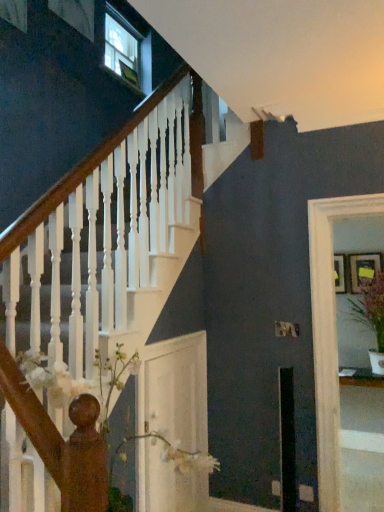
Locate an element on the screen. white glossy door at center, the 2th glass door in the right-to-left sequence is located at coordinates (175, 390).

The height and width of the screenshot is (512, 384). In order to click on wooden picture frame at right, the second picture frame in the right-to-left sequence in this screenshot , I will do `click(339, 273)`.

I want to click on white glossy door at center, the first glass door when ordered from left to right, so pos(175,390).

Which is in front, point (342, 289) or point (325, 293)?

The point (325, 293) is more forward.

Based on the photo, between wooden picture frame at right, the second picture frame in the right-to-left sequence, and clear glass door at right, the 2th glass door viewed from the left, which one has smaller size?

wooden picture frame at right, the second picture frame in the right-to-left sequence, is smaller.

Considering the relative sizes of wooden picture frame at right, the second picture frame in the right-to-left sequence, and clear glass door at right, the 2th glass door viewed from the left, in the image provided, is wooden picture frame at right, the second picture frame in the right-to-left sequence, taller than clear glass door at right, the 2th glass door viewed from the left,?

In fact, wooden picture frame at right, the second picture frame in the right-to-left sequence, may be shorter than clear glass door at right, the 2th glass door viewed from the left.

Is wooden picture frame at upper right, the 1th picture frame from the right, not within green leafy plant in white pot at right?

Yes.

Considering the relative sizes of wooden picture frame at upper right, the 1th picture frame from the right, and green leafy plant in white pot at right in the image provided, is wooden picture frame at upper right, the 1th picture frame from the right, smaller than green leafy plant in white pot at right?

Yes.

Which object is positioned more to the right, wooden picture frame at upper right, the 2th picture frame from the left, or green leafy plant in white pot at right?

From the viewer's perspective, wooden picture frame at upper right, the 2th picture frame from the left, appears more on the right side.

Is wooden picture frame at right, the second picture frame in the right-to-left sequence, positioned far away from green leafy plant in white pot at right?

wooden picture frame at right, the second picture frame in the right-to-left sequence, is actually quite close to green leafy plant in white pot at right.

The height and width of the screenshot is (512, 384). Find the location of `plant on the right of the wooden picture frame at right, the second picture frame in the right-to-left sequence`. plant on the right of the wooden picture frame at right, the second picture frame in the right-to-left sequence is located at coordinates (370, 306).

Considering the sizes of objects wooden picture frame at right, the second picture frame in the right-to-left sequence, and green leafy plant in white pot at right in the image provided, who is smaller, wooden picture frame at right, the second picture frame in the right-to-left sequence, or green leafy plant in white pot at right?

wooden picture frame at right, the second picture frame in the right-to-left sequence.

From the image's perspective, is clear glass door at right, the 1th glass door viewed from the right, located above white glossy door at center, the first glass door when ordered from left to right?

Yes, from the image's perspective, clear glass door at right, the 1th glass door viewed from the right, is over white glossy door at center, the first glass door when ordered from left to right.

Which object is more forward, clear glass door at right, the 1th glass door viewed from the right, or white glossy door at center, the first glass door when ordered from left to right?

white glossy door at center, the first glass door when ordered from left to right, is in front.

Considering the sizes of clear glass door at right, the 1th glass door viewed from the right, and white glossy door at center, the 2th glass door in the right-to-left sequence, in the image, is clear glass door at right, the 1th glass door viewed from the right, wider or thinner than white glossy door at center, the 2th glass door in the right-to-left sequence,?

Clearly, clear glass door at right, the 1th glass door viewed from the right, has more width compared to white glossy door at center, the 2th glass door in the right-to-left sequence.

Considering the positions of objects white glossy door at center, the first glass door when ordered from left to right, and wooden picture frame at right, which appears as the first picture frame when viewed from the left, in the image provided, who is more to the left, white glossy door at center, the first glass door when ordered from left to right, or wooden picture frame at right, which appears as the first picture frame when viewed from the left,?

white glossy door at center, the first glass door when ordered from left to right, is more to the left.

The width and height of the screenshot is (384, 512). I want to click on the 2nd picture frame behind the white glossy door at center, the first glass door when ordered from left to right, starting your count from the anchor, so click(339, 273).

From a real-world perspective, is white glossy door at center, the first glass door when ordered from left to right, under wooden picture frame at right, which appears as the first picture frame when viewed from the left?

Yes, from a real-world perspective, white glossy door at center, the first glass door when ordered from left to right, is below wooden picture frame at right, which appears as the first picture frame when viewed from the left.

Between white glossy door at center, the 2th glass door in the right-to-left sequence, and wooden picture frame at right, the second picture frame in the right-to-left sequence, which one has larger size?

Bigger between the two is white glossy door at center, the 2th glass door in the right-to-left sequence.

Looking at this image, from the image's perspective, between wooden picture frame at upper right, the 2th picture frame from the left, and clear glass door at right, the 1th glass door viewed from the right, which one is located above?

wooden picture frame at upper right, the 2th picture frame from the left, appears higher in the image.

Can you confirm if wooden picture frame at upper right, the 2th picture frame from the left, is positioned to the right of clear glass door at right, the 1th glass door viewed from the right?

Yes.

Considering the points (352, 273) and (313, 239), which point is in front, point (352, 273) or point (313, 239)?

Point (313, 239)

Which is closer to the camera, (334, 257) or (156, 503)?

Point (334, 257) appears to be farther away from the viewer than point (156, 503).

Find the location of a particular element. The image size is (384, 512). the 2nd glass door below the wooden picture frame at right, the second picture frame in the right-to-left sequence (from the image's perspective) is located at coordinates (175, 390).

Does wooden picture frame at right, which appears as the first picture frame when viewed from the left, contain white glossy door at center, the first glass door when ordered from left to right?

No, white glossy door at center, the first glass door when ordered from left to right, is not inside wooden picture frame at right, which appears as the first picture frame when viewed from the left.

Considering the positions of objects wooden picture frame at right, which appears as the first picture frame when viewed from the left, and white glossy door at center, the first glass door when ordered from left to right, in the image provided, who is in front, wooden picture frame at right, which appears as the first picture frame when viewed from the left, or white glossy door at center, the first glass door when ordered from left to right,?

Positioned in front is white glossy door at center, the first glass door when ordered from left to right.

From the clear glass door at right, the 1th glass door viewed from the right, count 2nd picture frames backward and point to it. Please provide its 2D coordinates.

[(339, 273)]

You are a GUI agent. You are given a task and a screenshot of the screen. Output one action in this format:
    pyautogui.click(x=<x>, y=<y>)
    Task: Click on the plant below the wooden picture frame at upper right, the 1th picture frame from the right (from the image's perspective)
    This screenshot has width=384, height=512.
    Given the screenshot: What is the action you would take?
    pyautogui.click(x=370, y=306)

Looking at the image, which one is located further to wooden picture frame at right, which appears as the first picture frame when viewed from the left, clear glass door at right, the 1th glass door viewed from the right, or green leafy plant in white pot at right?

Among the two, clear glass door at right, the 1th glass door viewed from the right, is located further to wooden picture frame at right, which appears as the first picture frame when viewed from the left.

Estimate the real-world distances between objects in this image. Which object is further from white glossy door at center, the 2th glass door in the right-to-left sequence, clear glass door at right, the 2th glass door viewed from the left, or wooden picture frame at upper right, the 1th picture frame from the right?

The object further to white glossy door at center, the 2th glass door in the right-to-left sequence, is wooden picture frame at upper right, the 1th picture frame from the right.

Estimate the real-world distances between objects in this image. Which object is further from wooden picture frame at upper right, the 1th picture frame from the right, green leafy plant in white pot at right or wooden picture frame at right, the second picture frame in the right-to-left sequence?

Among the two, green leafy plant in white pot at right is located further to wooden picture frame at upper right, the 1th picture frame from the right.

Estimate the real-world distances between objects in this image. Which object is further from green leafy plant in white pot at right, clear glass door at right, the 2th glass door viewed from the left, or wooden picture frame at upper right, the 1th picture frame from the right?

clear glass door at right, the 2th glass door viewed from the left.

From the image, which object appears to be farther from green leafy plant in white pot at right, white glossy door at center, the first glass door when ordered from left to right, or wooden picture frame at upper right, the 2th picture frame from the left?

Based on the image, white glossy door at center, the first glass door when ordered from left to right, appears to be further to green leafy plant in white pot at right.

From the image, which object appears to be nearer to green leafy plant in white pot at right, wooden picture frame at right, the second picture frame in the right-to-left sequence, or wooden picture frame at upper right, the 2th picture frame from the left?

The object closer to green leafy plant in white pot at right is wooden picture frame at upper right, the 2th picture frame from the left.

Looking at the image, which one is located closer to clear glass door at right, the 2th glass door viewed from the left, white glossy door at center, the 2th glass door in the right-to-left sequence, or wooden picture frame at upper right, the 1th picture frame from the right?

Among the two, white glossy door at center, the 2th glass door in the right-to-left sequence, is located nearer to clear glass door at right, the 2th glass door viewed from the left.

Based on their spatial positions, is wooden picture frame at upper right, the 1th picture frame from the right, or wooden picture frame at right, the second picture frame in the right-to-left sequence, further from white glossy door at center, the 2th glass door in the right-to-left sequence?

wooden picture frame at upper right, the 1th picture frame from the right.

Locate an element on the screen. The image size is (384, 512). picture frame between green leafy plant in white pot at right and wooden picture frame at right, the second picture frame in the right-to-left sequence, along the z-axis is located at coordinates (363, 269).

Locate an element on the screen. glass door between white glossy door at center, the first glass door when ordered from left to right, and wooden picture frame at right, which appears as the first picture frame when viewed from the left, in the front-back direction is located at coordinates (329, 334).

Where is `plant located between clear glass door at right, the 2th glass door viewed from the left, and wooden picture frame at right, which appears as the first picture frame when viewed from the left, in the depth direction`? plant located between clear glass door at right, the 2th glass door viewed from the left, and wooden picture frame at right, which appears as the first picture frame when viewed from the left, in the depth direction is located at coordinates (370, 306).

What are the coordinates of `glass door between white glossy door at center, the first glass door when ordered from left to right, and green leafy plant in white pot at right, in the horizontal direction` in the screenshot? It's located at (329, 334).